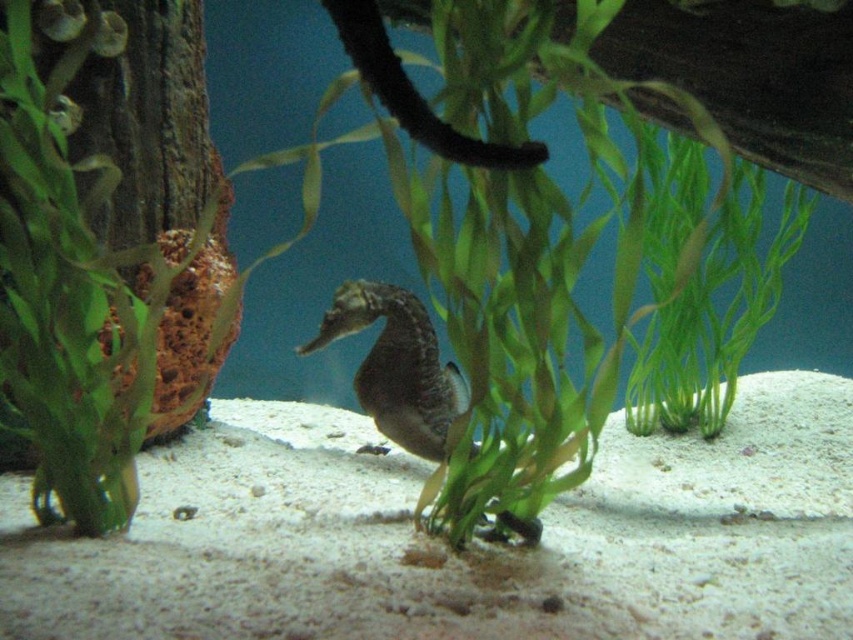
Question: Does green leafy plant at center have a larger size compared to smooth gray seahorse at center?

Choices:
 (A) no
 (B) yes

Answer: (B)

Question: Can you confirm if green leafy plant at center is positioned to the left of smooth gray seahorse at center?

Choices:
 (A) no
 (B) yes

Answer: (A)

Question: Which point is farther to the camera?

Choices:
 (A) smooth gray seahorse at center
 (B) green leafy plant at center

Answer: (A)

Question: Is green leafy plant at center closer to the viewer compared to smooth gray seahorse at center?

Choices:
 (A) no
 (B) yes

Answer: (B)

Question: Which of the following is the closest to the observer?

Choices:
 (A) (328, 323)
 (B) (418, 308)

Answer: (B)

Question: Among these objects, which one is nearest to the camera?

Choices:
 (A) smooth gray seahorse at center
 (B) green leafy plant at center

Answer: (B)